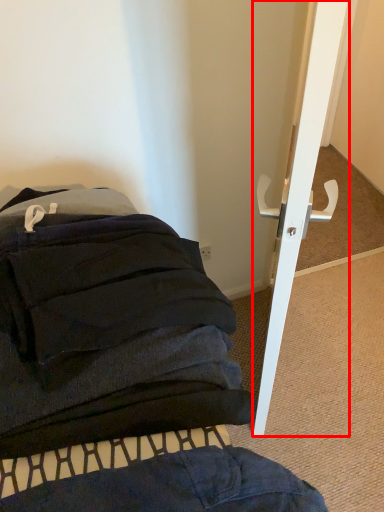
Question: From the image, what is the correct spatial relationship of door (annotated by the red box) in relation to furniture?

Choices:
 (A) right
 (B) left

Answer: (A)